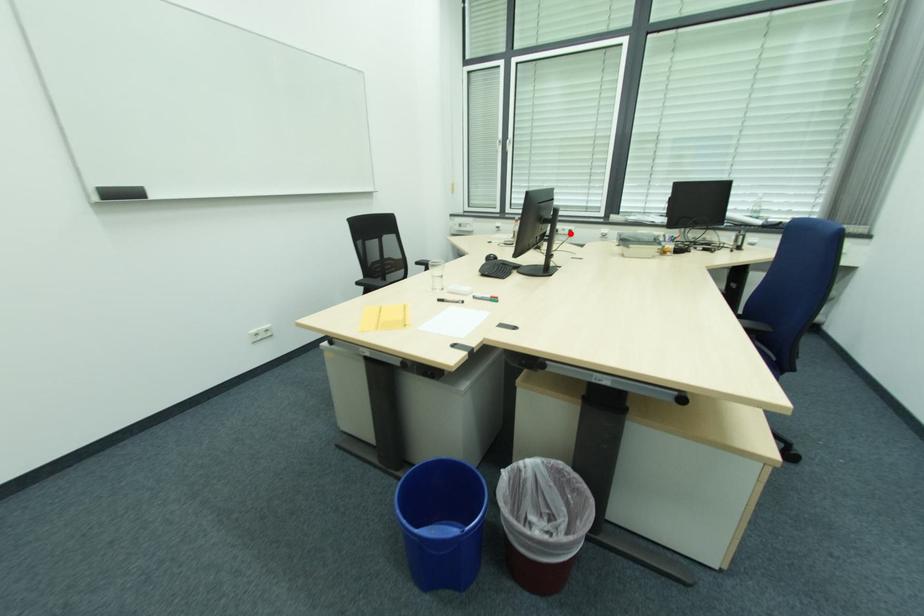
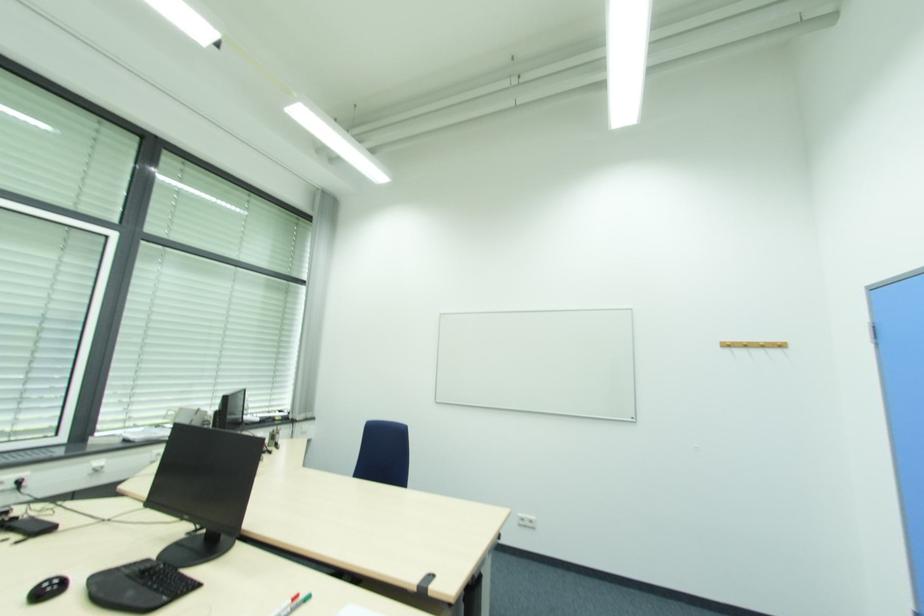
Question: I am providing you with two images of the same scene from different viewpoints. In image1, a red point is highlighted. Considering the same 3D point in image2, which of the following is correct?

Choices:
 (A) It is closer
 (B) It is farther

Answer: (A)